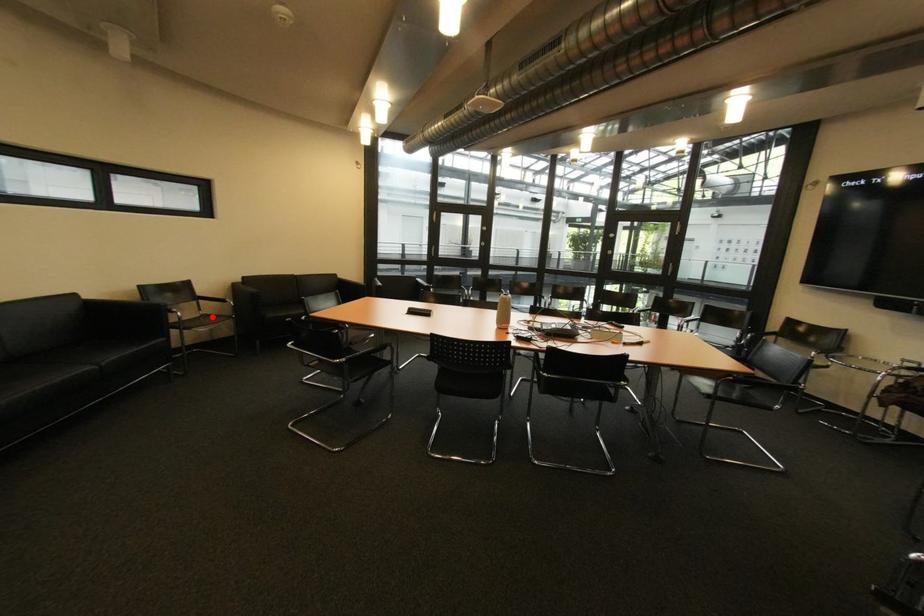
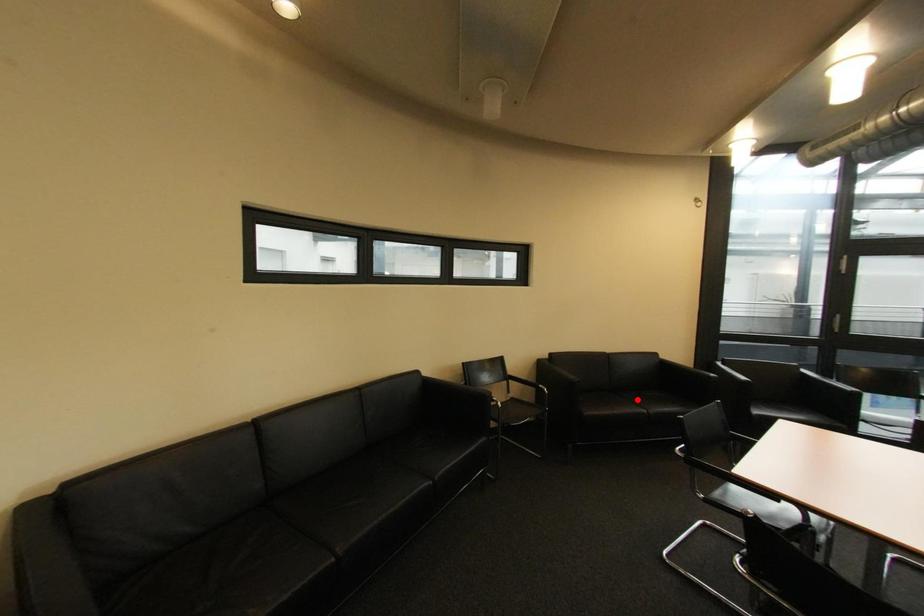
I am providing you with two images of the same scene from different viewpoints. A red point is marked on the first image and another point is marked on the second image. Does the point marked in image1 correspond to the same location as the one in image2?

No